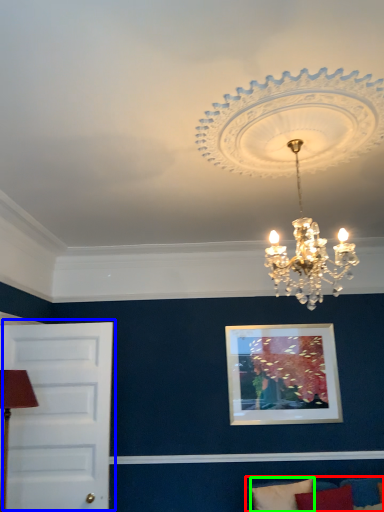
Question: Considering the real-world distances, which object is closest to couch (highlighted by a red box)? door (highlighted by a blue box) or pillow (highlighted by a green box).

Choices:
 (A) door
 (B) pillow

Answer: (B)